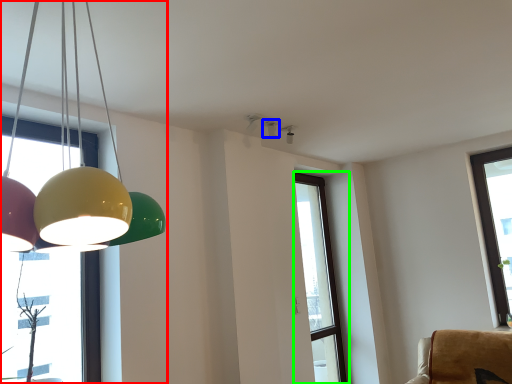
Question: Considering the real-world distances, which object is closest to lamp (highlighted by a red box)? lamp (highlighted by a blue box) or window (highlighted by a green box).

Choices:
 (A) lamp
 (B) window

Answer: (A)